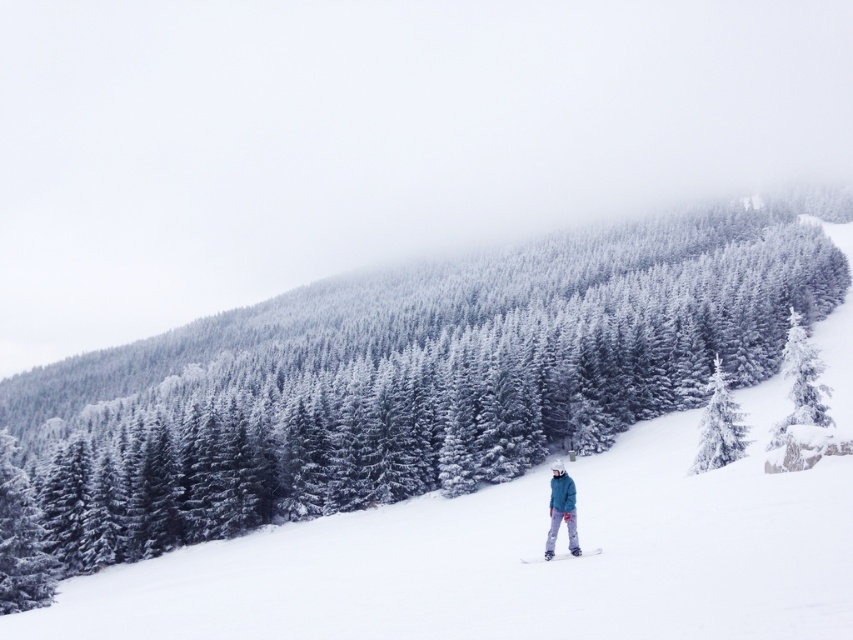
Question: Is white frosty pine at center to the left of teal softshell jacket at center from the viewer's perspective?

Choices:
 (A) no
 (B) yes

Answer: (A)

Question: Is white frosty tree at center-right positioned in front of teal softshell jacket at center?

Choices:
 (A) no
 (B) yes

Answer: (A)

Question: Which point appears closest to the camera in this image?

Choices:
 (A) (708, 416)
 (B) (798, 378)
 (C) (567, 524)

Answer: (C)

Question: Among these points, which one is nearest to the camera?

Choices:
 (A) (573, 513)
 (B) (699, 420)
 (C) (560, 497)

Answer: (C)

Question: Which point is closer to the camera taking this photo?

Choices:
 (A) (717, 445)
 (B) (751, 365)
 (C) (560, 472)
 (D) (585, 554)

Answer: (D)

Question: Is white frosty pine at center smaller than teal softshell jacket at center?

Choices:
 (A) no
 (B) yes

Answer: (A)